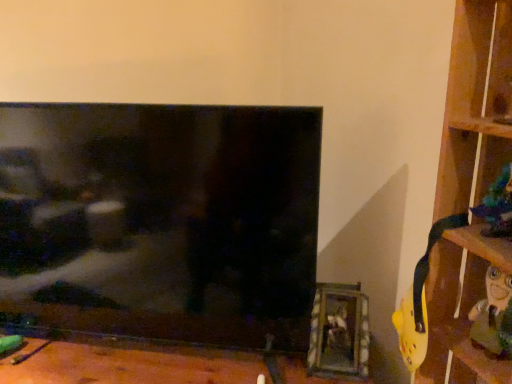
I want to click on shiny blue figurine at right, so click(497, 206).

Identify the location of black glossy tv at center. (161, 220).

This screenshot has height=384, width=512. In order to click on shiny blue figurine at right in this screenshot , I will do `click(497, 206)`.

Considering the positions of point (25, 276) and point (347, 311), is point (25, 276) closer or farther from the camera than point (347, 311)?

Point (25, 276).

Is black glossy tv at center situated inside wooden picture frame at lower right or outside?

black glossy tv at center is not inside wooden picture frame at lower right, it's outside.

Does black glossy tv at center have a greater height compared to wooden picture frame at lower right?

Yes.

From a real-world perspective, is shiny blue figurine at right positioned over wooden at right based on gravity?

Yes, from a real-world perspective, shiny blue figurine at right is above wooden at right.

Does point (472, 207) lie in front of point (487, 134)?

No, (472, 207) is behind (487, 134).

Do you think shiny blue figurine at right is within wooden at right, or outside of it?

shiny blue figurine at right is spatially positioned inside wooden at right.

I want to click on toy behind the wooden at right, so click(497, 206).

Can you confirm if shiny blue figurine at right is positioned to the left of wooden picture frame at lower right?

No, shiny blue figurine at right is not to the left of wooden picture frame at lower right.

In the scene shown: Is wooden picture frame at lower right at the back of shiny blue figurine at right?

That's not correct — shiny blue figurine at right is not looking away from wooden picture frame at lower right.

Does shiny blue figurine at right contain wooden picture frame at lower right?

Actually, wooden picture frame at lower right is outside shiny blue figurine at right.

Considering the positions of point (340, 324) and point (83, 247), is point (340, 324) closer or farther from the camera than point (83, 247)?

Point (340, 324) appears to be closer to the viewer than point (83, 247).

In the image, there is a wooden picture frame at lower right. Where is `television above it (from the image's perspective)`? This screenshot has height=384, width=512. television above it (from the image's perspective) is located at coordinates (161, 220).

Between wooden picture frame at lower right and black glossy tv at center, which one appears on the right side from the viewer's perspective?

Positioned to the right is wooden picture frame at lower right.

Considering the relative sizes of wooden picture frame at lower right and black glossy tv at center in the image provided, is wooden picture frame at lower right bigger than black glossy tv at center?

Actually, wooden picture frame at lower right might be smaller than black glossy tv at center.

Is wooden at right at the right side of shiny blue figurine at right?

No, wooden at right is not to the right of shiny blue figurine at right.

Does wooden at right touch shiny blue figurine at right?

wooden at right is not next to shiny blue figurine at right, and they're not touching.

Can you tell me how much wooden at right and shiny blue figurine at right differ in facing direction?

wooden at right and shiny blue figurine at right are facing 0.00293 degrees away from each other.

Based on the photo, measure the distance between black glossy tv at center and shiny blue figurine at right.

black glossy tv at center is 75.32 centimeters away from shiny blue figurine at right.

Can you confirm if black glossy tv at center is taller than shiny blue figurine at right?

Yes, black glossy tv at center is taller than shiny blue figurine at right.

Between black glossy tv at center and shiny blue figurine at right, which one appears on the left side from the viewer's perspective?

From the viewer's perspective, black glossy tv at center appears more on the left side.

How many degrees apart are the facing directions of black glossy tv at center and shiny blue figurine at right?

61.4 degrees.

From the image's perspective, relative to wooden at right, is wooden picture frame at lower right above or below?

wooden picture frame at lower right is situated lower than wooden at right in the image.

Considering their positions, is wooden picture frame at lower right located in front of or behind wooden at right?

In the image, wooden picture frame at lower right appears behind wooden at right.

From a real-world perspective, is wooden picture frame at lower right over wooden at right?

No, from a real-world perspective, wooden picture frame at lower right is not above wooden at right.

Is point (318, 342) more distant than point (456, 341)?

Yes, point (318, 342) is farther from viewer.

The width and height of the screenshot is (512, 384). What are the coordinates of `television on the left of the wooden picture frame at lower right` in the screenshot? It's located at (161, 220).

Where is `shelf below the shiny blue figurine at right (from a real-world perspective)`? The width and height of the screenshot is (512, 384). shelf below the shiny blue figurine at right (from a real-world perspective) is located at coordinates click(475, 104).

When comparing their distances from wooden at right, does wooden picture frame at lower right or black glossy tv at center seem further?

black glossy tv at center.

From the image, which object appears to be nearer to wooden at right, shiny blue figurine at right or wooden picture frame at lower right?

Based on the image, shiny blue figurine at right appears to be nearer to wooden at right.

Looking at the image, which one is located closer to wooden picture frame at lower right, shiny blue figurine at right or wooden at right?

wooden at right is closer to wooden picture frame at lower right.

Estimate the real-world distances between objects in this image. Which object is further from wooden at right, black glossy tv at center or shiny blue figurine at right?

Based on the image, black glossy tv at center appears to be further to wooden at right.

Estimate the real-world distances between objects in this image. Which object is further from black glossy tv at center, wooden picture frame at lower right or wooden at right?

wooden at right.

Based on their spatial positions, is wooden picture frame at lower right or wooden at right closer to shiny blue figurine at right?

wooden at right is positioned closer to the anchor shiny blue figurine at right.

Looking at the image, which one is located further to wooden at right, shiny blue figurine at right or black glossy tv at center?

The object further to wooden at right is black glossy tv at center.

From the image, which object appears to be farther from wooden picture frame at lower right, black glossy tv at center or shiny blue figurine at right?

Based on the image, shiny blue figurine at right appears to be further to wooden picture frame at lower right.

This screenshot has width=512, height=384. I want to click on shelf between black glossy tv at center and shiny blue figurine at right from left to right, so click(475, 104).

This screenshot has width=512, height=384. I want to click on picture frame situated between black glossy tv at center and wooden at right from left to right, so click(x=339, y=332).

This screenshot has width=512, height=384. Find the location of `toy between wooden at right and wooden picture frame at lower right in the front-back direction`. toy between wooden at right and wooden picture frame at lower right in the front-back direction is located at coordinates (497, 206).

Where is `picture frame located between black glossy tv at center and shiny blue figurine at right in the left-right direction`? The width and height of the screenshot is (512, 384). picture frame located between black glossy tv at center and shiny blue figurine at right in the left-right direction is located at coordinates (339, 332).